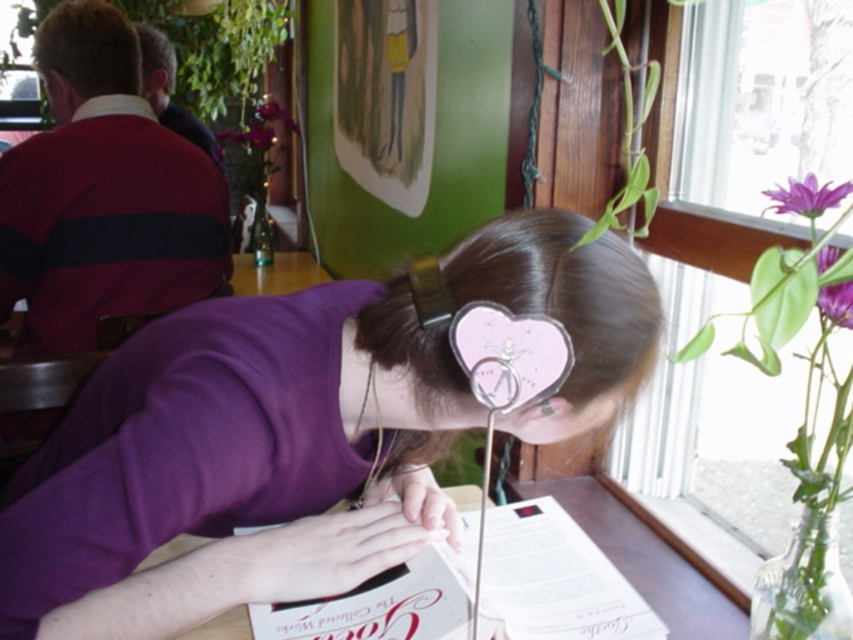
Question: Which point is farther to the camera?

Choices:
 (A) (381, 604)
 (B) (566, 616)

Answer: (B)

Question: Does matte pink paper at center come in front of purple paper heart at upper right?

Choices:
 (A) no
 (B) yes

Answer: (A)

Question: Estimate the real-world distances between objects in this image. Which object is farther from the matte pink paper at center?

Choices:
 (A) purple paper heart at upper right
 (B) white paper menu at lower center

Answer: (A)

Question: Is matte pink paper at center above purple matte flower at upper right?

Choices:
 (A) yes
 (B) no

Answer: (B)

Question: Does purple matte shirt at center come behind matte pink paper at center?

Choices:
 (A) yes
 (B) no

Answer: (B)

Question: Among these points, which one is farthest from the camera?

Choices:
 (A) (257, 429)
 (B) (828, 202)
 (C) (585, 595)
 (D) (827, 285)

Answer: (C)